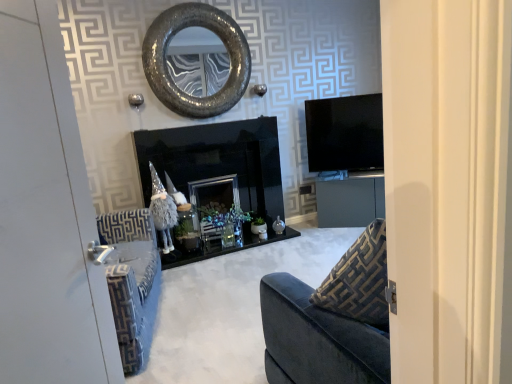
Question: Is point (196, 115) positioned closer to the camera than point (318, 210)?

Choices:
 (A) closer
 (B) farther

Answer: (A)

Question: Is textured metallic mirror at upper center situated inside matte gray cabinet at center or outside?

Choices:
 (A) outside
 (B) inside

Answer: (A)

Question: Estimate the real-world distances between objects in this image. Which object is farther from the black glossy fireplace at center?

Choices:
 (A) white painted wood door at left
 (B) textured metallic mirror at upper center
 (C) matte gray cabinet at center

Answer: (A)

Question: Estimate the real-world distances between objects in this image. Which object is closer to the textured metallic mirror at upper center?

Choices:
 (A) black glossy fireplace at center
 (B) matte gray cabinet at center
 (C) white painted wood door at left

Answer: (A)